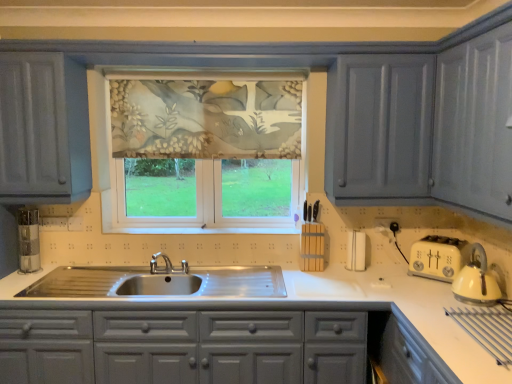
Question: From a real-world perspective, is white glossy countertop at center below floral fabric window at center?

Choices:
 (A) no
 (B) yes

Answer: (B)

Question: Can you confirm if white glossy countertop at center is thinner than floral fabric window at center?

Choices:
 (A) no
 (B) yes

Answer: (A)

Question: Is white glossy countertop at center outside of floral fabric window at center?

Choices:
 (A) yes
 (B) no

Answer: (A)

Question: Are white glossy countertop at center and floral fabric window at center beside each other?

Choices:
 (A) no
 (B) yes

Answer: (A)

Question: Is white glossy countertop at center in front of floral fabric window at center?

Choices:
 (A) no
 (B) yes

Answer: (B)

Question: Does white glossy countertop at center have a larger size compared to floral fabric window at center?

Choices:
 (A) yes
 (B) no

Answer: (A)

Question: Does floral fabric window at center have a lesser width compared to white glossy countertop at center?

Choices:
 (A) no
 (B) yes

Answer: (B)

Question: Does floral fabric window at center come in front of white glossy countertop at center?

Choices:
 (A) yes
 (B) no

Answer: (B)

Question: Does floral fabric window at center lie behind white glossy countertop at center?

Choices:
 (A) yes
 (B) no

Answer: (A)

Question: Does floral fabric window at center appear on the left side of white glossy countertop at center?

Choices:
 (A) yes
 (B) no

Answer: (B)

Question: Is floral fabric window at center bigger than white glossy countertop at center?

Choices:
 (A) no
 (B) yes

Answer: (A)

Question: Does floral fabric window at center contain white glossy countertop at center?

Choices:
 (A) yes
 (B) no

Answer: (B)

Question: Considering the relative positions of floral fabric window at center and white glossy countertop at center in the image provided, is floral fabric window at center to the left or to the right of white glossy countertop at center?

Choices:
 (A) right
 (B) left

Answer: (A)